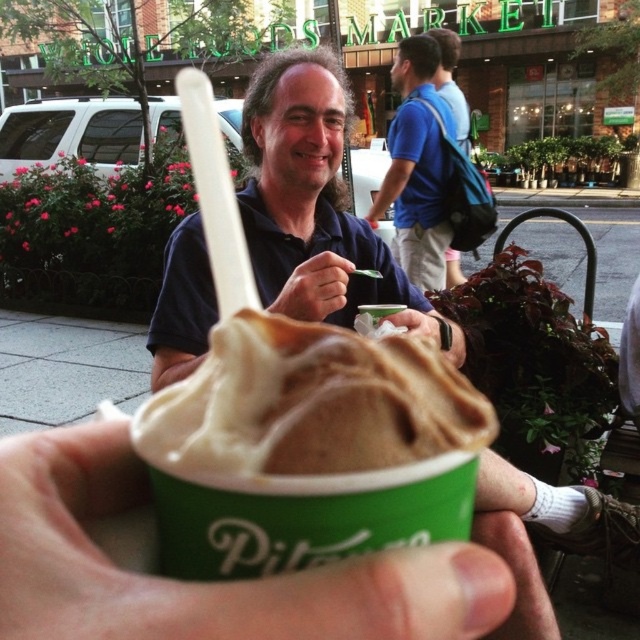
Question: Can you confirm if whipped cream at center is smaller than matte black hand at center?

Choices:
 (A) no
 (B) yes

Answer: (A)

Question: Among these objects, which one is farthest from the camera?

Choices:
 (A) whipped cream at center
 (B) white matte cup at lower center
 (C) matte black hand at center

Answer: (C)

Question: Does blue cotton shirt at upper center have a smaller size compared to matte black hand at center?

Choices:
 (A) yes
 (B) no

Answer: (B)

Question: Which of the following is the closest to the observer?

Choices:
 (A) blue cotton shirt at upper center
 (B) white matte cup at lower center

Answer: (B)

Question: Among these objects, which one is farthest from the camera?

Choices:
 (A) matte black hand at center
 (B) white matte cup at lower center

Answer: (A)

Question: Is white matte cup at lower center bigger than blue cotton shirt at upper center?

Choices:
 (A) no
 (B) yes

Answer: (A)